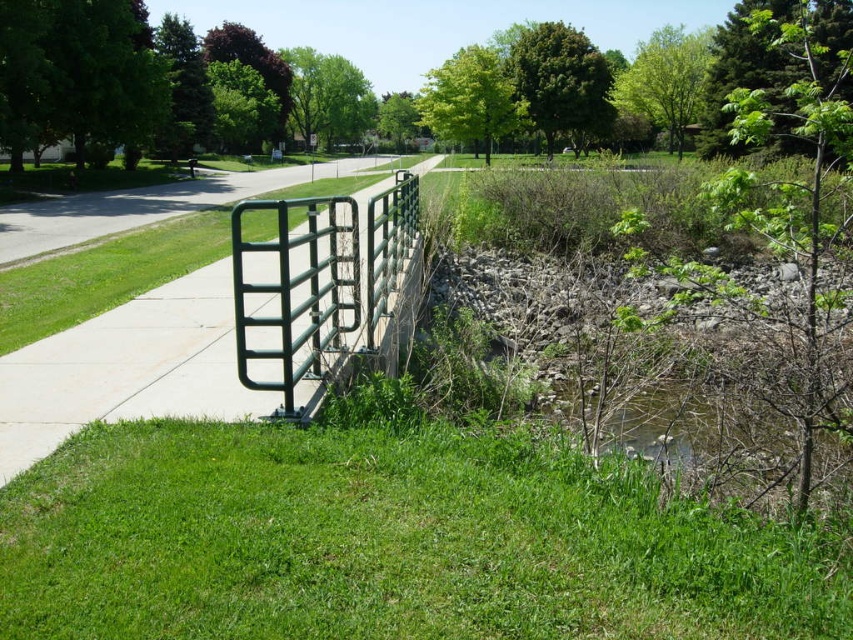
You are a gardener who needs to mow the green grass at lower center and trim the green metal fence at center. Which task should you do first if you want to tackle the shorter object first?

The green grass at lower center has a lesser height compared to the green metal fence at center, so you should mow the green grass at lower center first since it is shorter.

A child is standing at the point marked at coordinates point [427,508]. They want to throw a ball to their friend who is standing exactly 4 meters away. Will the ball reach their friend if they throw it as far as possible?

The distance between the two points is 3.86 meters, which is less than 4 meters. Therefore, if the child throws the ball as far as possible, it might not reach their friend who is 4 meters away unless the throw is extremely accurate and powerful.